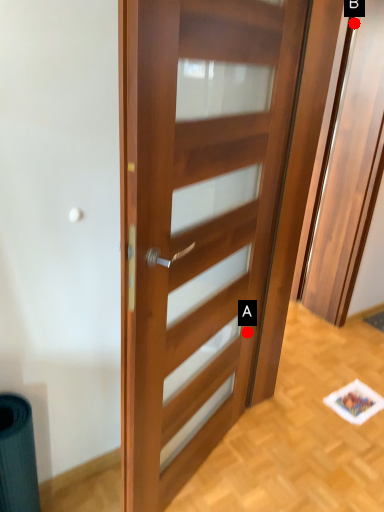
Question: Two points are circled on the image, labeled by A and B beside each circle. Which point is farther to the camera?

Choices:
 (A) A is further
 (B) B is further

Answer: (B)